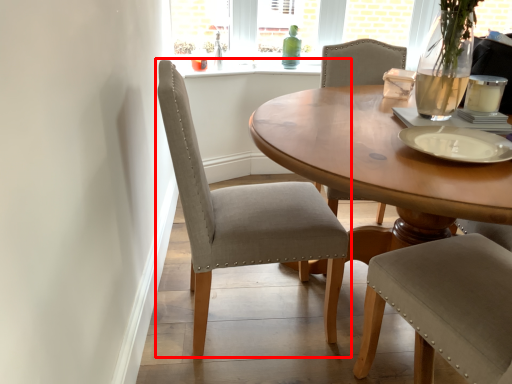
Question: Where is chair (annotated by the red box) located in relation to platter in the image?

Choices:
 (A) left
 (B) right

Answer: (A)